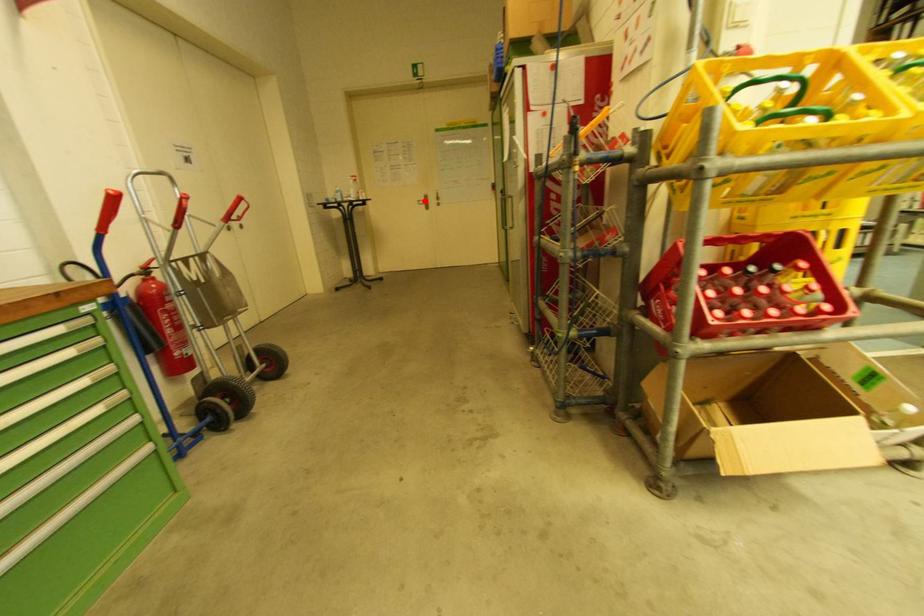
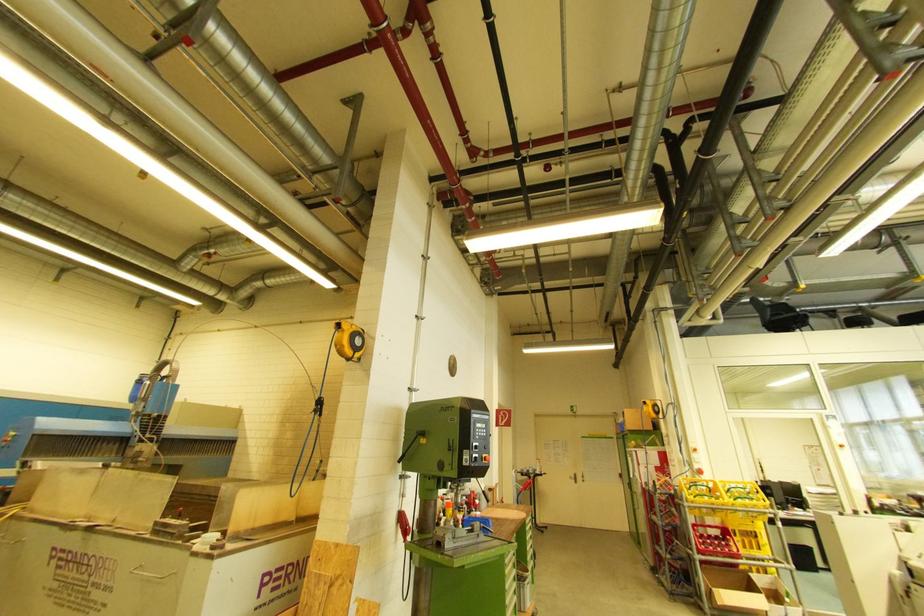
Find the pixel in the second image that matches the highlighted location in the first image.

(575, 477)